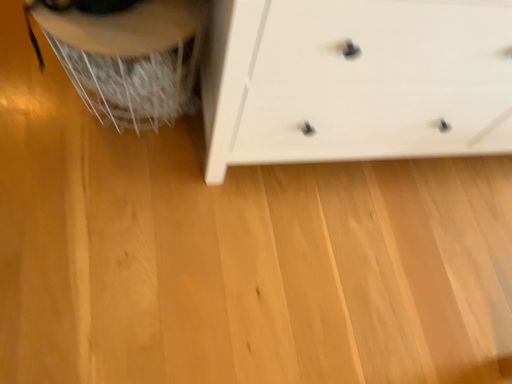
Where is `free space in front of white matte chest of drawers at center`? This screenshot has height=384, width=512. free space in front of white matte chest of drawers at center is located at coordinates (297, 273).